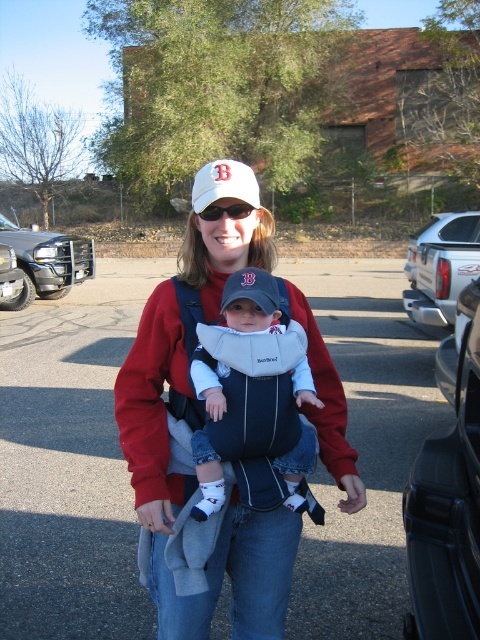
Question: Which of the following is the farthest from the observer?

Choices:
 (A) [414, 541]
 (B) [64, 268]
 (C) [193, 204]
 (D) [253, 314]

Answer: (B)

Question: Is gray asphalt parking lot at center bigger than white matte baseball cap at center?

Choices:
 (A) yes
 (B) no

Answer: (B)

Question: Which is farther from the gray asphalt parking lot at center?

Choices:
 (A) matte red sweatshirt at center
 (B) white cotton baby carrier at center
 (C) white matte baseball cap at center

Answer: (C)

Question: Is gray asphalt parking lot at center wider than white matte baseball cap at center?

Choices:
 (A) no
 (B) yes

Answer: (B)

Question: Which point is farther from the camera taking this photo?

Choices:
 (A) (345, 448)
 (B) (468, 228)

Answer: (B)

Question: Is white cotton baby carrier at center smaller than brushed metal truck at left?

Choices:
 (A) yes
 (B) no

Answer: (A)